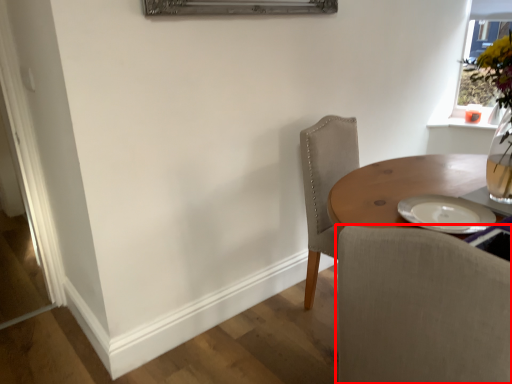
Question: Observing the image, what is the correct spatial positioning of chair (annotated by the red box) in reference to window?

Choices:
 (A) left
 (B) right

Answer: (A)